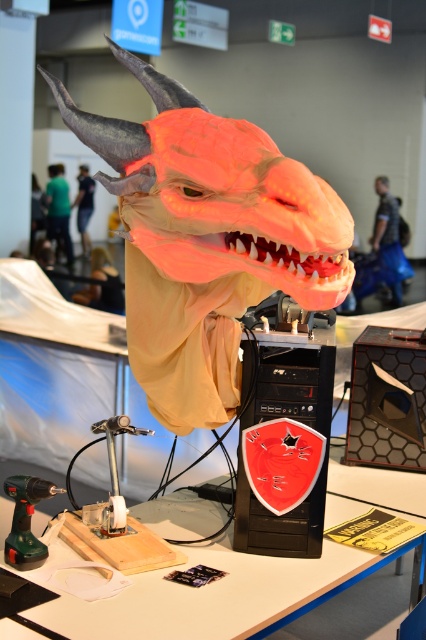
Question: Estimate the real-world distances between objects in this image. Which object is farther from the matte orange mask at center?

Choices:
 (A) green plastic drill at lower left
 (B) rubber-like orange dragon head at center

Answer: (A)

Question: Is green plastic drill at lower left positioned before matte orange mask at center?

Choices:
 (A) yes
 (B) no

Answer: (A)

Question: Is white plastic table at center wider than green plastic drill at lower left?

Choices:
 (A) no
 (B) yes

Answer: (B)

Question: Which of the following is the farthest from the observer?

Choices:
 (A) green plastic drill at lower left
 (B) matte orange mask at center

Answer: (B)

Question: Does white plastic table at center appear over matte orange mask at center?

Choices:
 (A) no
 (B) yes

Answer: (A)

Question: Which point is farther to the camera?

Choices:
 (A) (339, 506)
 (B) (379, 180)
 (C) (11, 544)

Answer: (B)